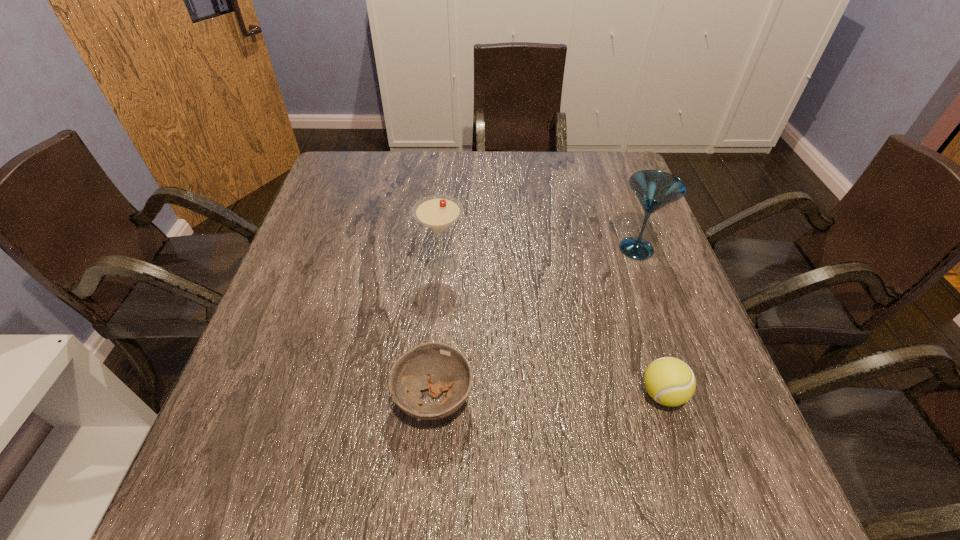
Where is `empty location between the third tallest object and the left martini`? empty location between the third tallest object and the left martini is located at coordinates (553, 330).

Identify the location of unoccupied area between the bowl and the left martini. (438, 332).

You are a GUI agent. You are given a task and a screenshot of the screen. Output one action in this format:
    pyautogui.click(x=<x>, y=<y>)
    Task: Click on the free space between the tennis ball and the right martini
    This screenshot has width=960, height=540.
    Given the screenshot: What is the action you would take?
    pyautogui.click(x=649, y=321)

At what (x,y) coordinates should I click in order to perform the action: click on free space that is in between the shortest object and the left martini. Please return your answer as a coordinate pair (x, y). Looking at the image, I should click on (438, 332).

You are a GUI agent. You are given a task and a screenshot of the screen. Output one action in this format:
    pyautogui.click(x=<x>, y=<y>)
    Task: Click on the second closest object to the left martini
    This screenshot has width=960, height=540.
    Given the screenshot: What is the action you would take?
    pyautogui.click(x=654, y=189)

At what (x,y) coordinates should I click in order to perform the action: click on object that is the nearest to the bowl. Please return your answer as a coordinate pair (x, y). Looking at the image, I should click on (438, 213).

Where is `blank area in the image that satisfies the following two spatial constraints: 1. on the back side of the tennis ball; 2. on the left side of the shortest object`? This screenshot has height=540, width=960. blank area in the image that satisfies the following two spatial constraints: 1. on the back side of the tennis ball; 2. on the left side of the shortest object is located at coordinates (434, 394).

Identify the location of free region that satisfies the following two spatial constraints: 1. on the back side of the third tallest object; 2. on the right side of the right martini. (616, 249).

Identify the location of blank space that satisfies the following two spatial constraints: 1. on the back side of the right martini; 2. on the right side of the shortest object. This screenshot has height=540, width=960. (445, 249).

Find the location of a particular element. Image resolution: width=960 pixels, height=540 pixels. free space that satisfies the following two spatial constraints: 1. on the front side of the left martini; 2. on the right side of the shortest object is located at coordinates tap(431, 397).